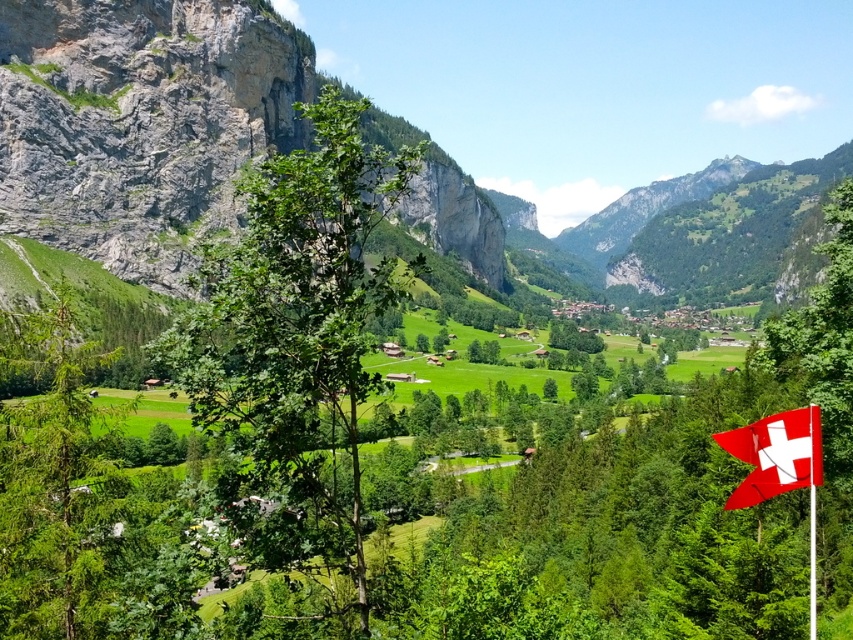
Describe the element at coordinates (297, 340) in the screenshot. I see `green leafy tree at center` at that location.

Consider the image. Can you confirm if green leafy tree at center is thinner than green matte tree at left?

Yes, green leafy tree at center is thinner than green matte tree at left.

Is point (312, 428) farther from viewer compared to point (76, 552)?

That is True.

The image size is (853, 640). I want to click on green leafy tree at center, so click(x=297, y=340).

Does green matte tree at left lie behind red fabric flag at lower right?

That is False.

Between point (91, 480) and point (802, 458), which one is positioned behind?

Point (91, 480)

Where is `green matte tree at left`? The width and height of the screenshot is (853, 640). green matte tree at left is located at coordinates (54, 481).

Is rugged stone mountain at left bigger than green leafy tree at center?

Indeed, rugged stone mountain at left has a larger size compared to green leafy tree at center.

Which is behind, point (10, 54) or point (331, 525)?

The point (10, 54) is behind.

Which is in front, point (306, 125) or point (287, 244)?

Point (287, 244)

This screenshot has width=853, height=640. Find the location of `rugged stone mountain at left`. rugged stone mountain at left is located at coordinates (141, 122).